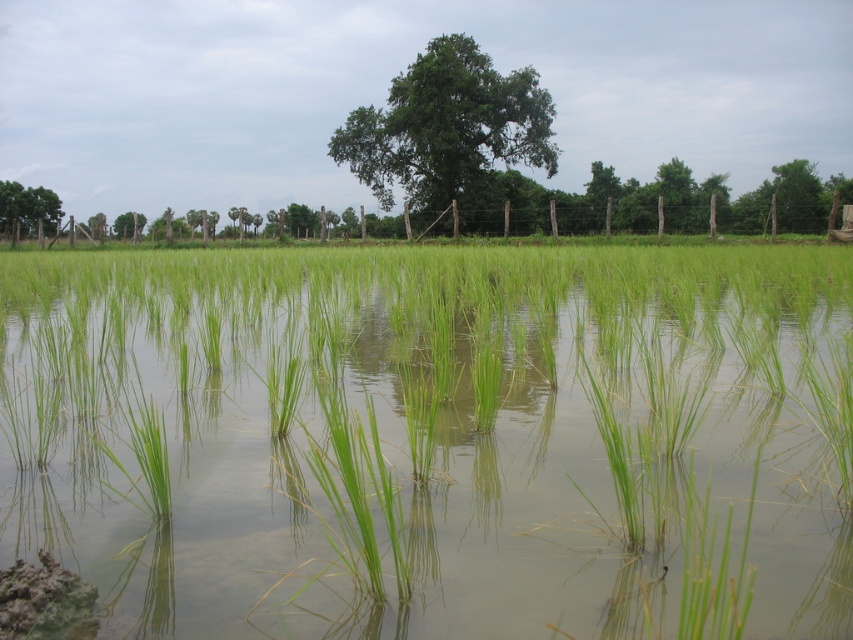
You are standing in the middle of the rice paddy and want to walk towards the green leafy tree at center. Which direction should you move relative to the green grassy rice field at center?

You should move to the right relative to the green grassy rice field at center because the green grassy rice field at center is to the left of the green leafy tree at center.

In the scene shown: You are a farmer planning to plant a new row of rice plants between the green leafy tree at center and the green leafy tree at upper left. Which tree has a wider trunk that might require more space to avoid obstruction?

The green leafy tree at center has a wider trunk than the green leafy tree at upper left, so it requires more space to avoid obstruction.